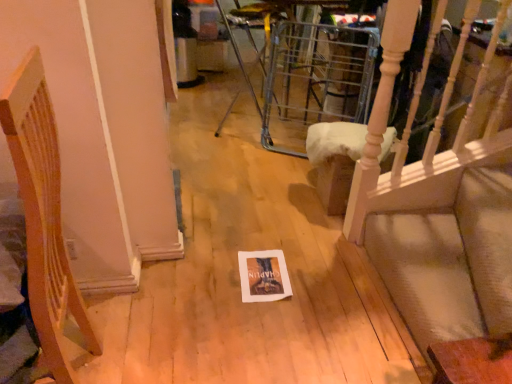
Question: Can you confirm if wooden chair at left, which is the second furniture from back to front, is shorter than light wood chair at upper right, which ranks as the second furniture in left-to-right order?

Choices:
 (A) no
 (B) yes

Answer: (A)

Question: Would you consider wooden chair at left, the first furniture positioned from the left, to be distant from light wood chair at upper right, which appears as the first furniture when viewed from the right?

Choices:
 (A) yes
 (B) no

Answer: (A)

Question: Is wooden chair at left, which is the second furniture from back to front, wider than light wood chair at upper right, which appears as the 1th furniture when viewed from the back?

Choices:
 (A) yes
 (B) no

Answer: (A)

Question: Does wooden chair at left, the 2th furniture when ordered from right to left, contain light wood chair at upper right, which ranks as the second furniture in left-to-right order?

Choices:
 (A) yes
 (B) no

Answer: (B)

Question: From a real-world perspective, is wooden chair at left, the 2th furniture when ordered from right to left, on top of light wood chair at upper right, the second furniture from the front?

Choices:
 (A) no
 (B) yes

Answer: (B)

Question: From a real-world perspective, is wooden chair at left, which is the second furniture from back to front, positioned under light wood chair at upper right, which ranks as the second furniture in left-to-right order, based on gravity?

Choices:
 (A) no
 (B) yes

Answer: (A)

Question: Is light wood chair at upper right, which appears as the first furniture when viewed from the right, located outside wooden chair at left, which is the second furniture from back to front?

Choices:
 (A) yes
 (B) no

Answer: (A)

Question: Can you confirm if light wood chair at upper right, the second furniture from the front, is bigger than wooden chair at left, the 1th furniture positioned from the front?

Choices:
 (A) yes
 (B) no

Answer: (B)

Question: Can you confirm if light wood chair at upper right, which appears as the 1th furniture when viewed from the back, is positioned to the right of wooden chair at left, the 1th furniture positioned from the front?

Choices:
 (A) no
 (B) yes

Answer: (B)

Question: Can you confirm if light wood chair at upper right, which ranks as the second furniture in left-to-right order, is smaller than wooden chair at left, the 1th furniture positioned from the front?

Choices:
 (A) no
 (B) yes

Answer: (B)

Question: Is light wood chair at upper right, which appears as the 1th furniture when viewed from the back, touching wooden chair at left, the 2th furniture when ordered from right to left?

Choices:
 (A) yes
 (B) no

Answer: (B)

Question: Considering the relative sizes of light wood chair at upper right, which ranks as the second furniture in left-to-right order, and wooden chair at left, the 2th furniture when ordered from right to left, in the image provided, is light wood chair at upper right, which ranks as the second furniture in left-to-right order, thinner than wooden chair at left, the 2th furniture when ordered from right to left,?

Choices:
 (A) no
 (B) yes

Answer: (B)

Question: Based on their positions, is light wood chair at upper right, which appears as the 1th furniture when viewed from the back, located to the left or right of wooden chair at left, the 2th furniture when ordered from right to left?

Choices:
 (A) left
 (B) right

Answer: (B)